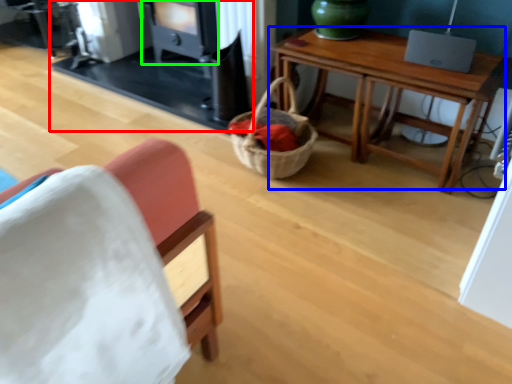
Question: Estimate the real-world distances between objects in this image. Which object is closer to fireplace (highlighted by a red box), table (highlighted by a blue box) or stove (highlighted by a green box)?

Choices:
 (A) table
 (B) stove

Answer: (B)